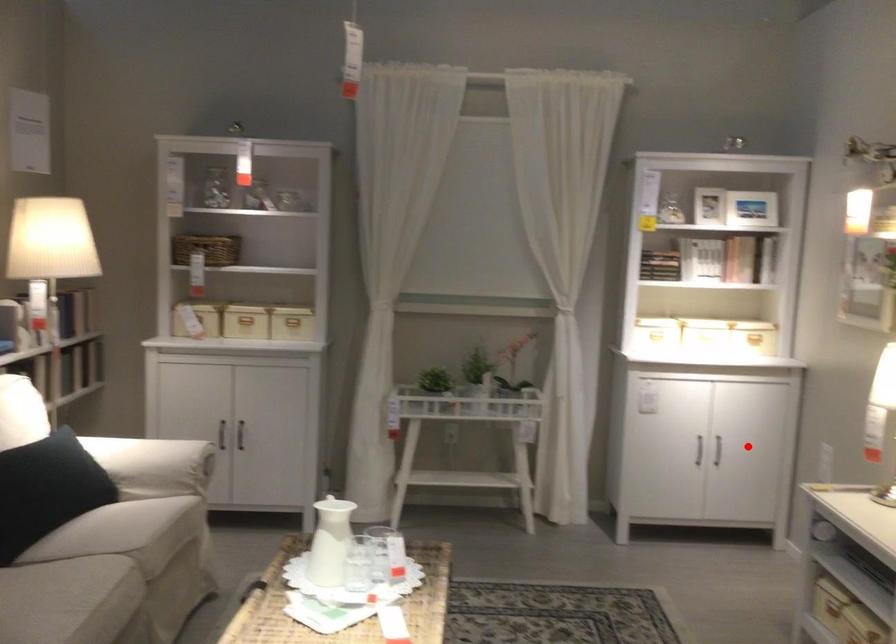
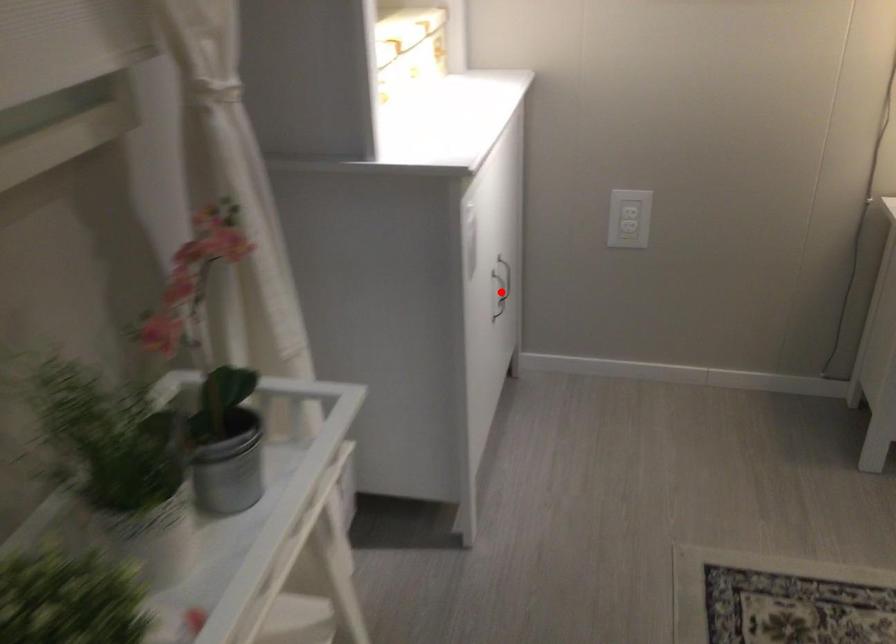
I am providing you with two images of the same scene from different viewpoints. A red point is marked on the first image and another point is marked on the second image. Do the highlighted points in image1 and image2 indicate the same real-world spot?

Yes